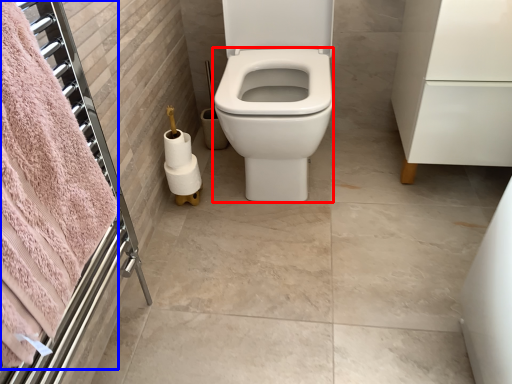
Question: Which of the following is the closest to the observer, bidet (highlighted by a red box) or bath towel (highlighted by a blue box)?

Choices:
 (A) bidet
 (B) bath towel

Answer: (B)